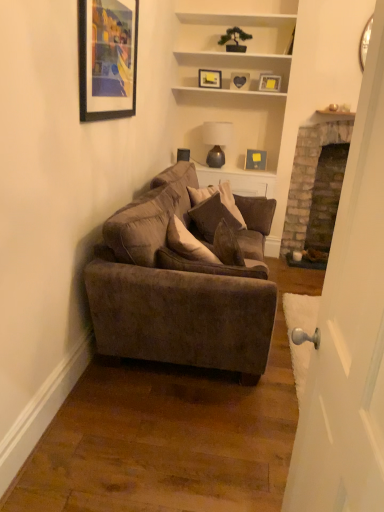
Identify the location of white wood shelves at upper center. This screenshot has width=384, height=512. coord(231,52).

The width and height of the screenshot is (384, 512). Describe the element at coordinates (308, 176) in the screenshot. I see `brick fireplace at right` at that location.

The image size is (384, 512). In order to click on white glossy door at right in this screenshot , I will do `click(349, 330)`.

Find the location of `matte gold picture frame at upper center, which ranks as the fourth picture frame in back-to-front order`. matte gold picture frame at upper center, which ranks as the fourth picture frame in back-to-front order is located at coordinates (269, 82).

At what (x,y) coordinates should I click in order to perform the action: click on matte wooden picture frame at upper center, placed as the 4th picture frame when sorted from right to left. Please return your answer as a coordinate pair (x, y). This screenshot has height=512, width=384. Looking at the image, I should click on (210, 78).

Locate an element on the screen. This screenshot has width=384, height=512. velvet brown couch at center is located at coordinates (182, 284).

Which object is further away from the camera taking this photo, matte gold picture frame at upper center, positioned as the 2th picture frame in front-to-back order, or matte black picture frame at upper left, which is counted as the 1th picture frame, starting from the front?

matte gold picture frame at upper center, positioned as the 2th picture frame in front-to-back order, is further from the camera.

Which is correct: matte gold picture frame at upper center, positioned as the 2th picture frame in front-to-back order, is inside matte black picture frame at upper left, which ranks as the 5th picture frame in back-to-front order, or outside of it?

matte gold picture frame at upper center, positioned as the 2th picture frame in front-to-back order, is spatially situated outside matte black picture frame at upper left, which ranks as the 5th picture frame in back-to-front order.

Would you say matte gold picture frame at upper center, marked as the 1th picture frame in a right-to-left arrangement, is to the left or to the right of matte black picture frame at upper left, which is counted as the 1th picture frame, starting from the front, in the picture?

Based on their positions, matte gold picture frame at upper center, marked as the 1th picture frame in a right-to-left arrangement, is located to the right of matte black picture frame at upper left, which is counted as the 1th picture frame, starting from the front.

How different are the orientations of matte gold picture frame at upper center, which is the 5th picture frame in left-to-right order, and matte black picture frame at upper left, which is counted as the 1th picture frame, starting from the front, in degrees?

They differ by 109 degrees in their facing directions.

From the image's perspective, who appears lower, suede-like brown pillow at center or brick fireplace at right?

suede-like brown pillow at center appears lower in the image.

Is suede-like brown pillow at center not within brick fireplace at right?

That's correct, suede-like brown pillow at center is outside of brick fireplace at right.

From a real-world perspective, between suede-like brown pillow at center and brick fireplace at right, who is vertically lower?

In real-world perspective, suede-like brown pillow at center is lower.

Does suede-like brown pillow at center lie in front of brick fireplace at right?

That is True.

Is suede-like brown pillow at center located outside velvet brown couch at center?

No, most part of suede-like brown pillow at center lies within velvet brown couch at center.

Who is taller, suede-like brown pillow at center or velvet brown couch at center?

With more height is velvet brown couch at center.

Which object is thinner, suede-like brown pillow at center or velvet brown couch at center?

suede-like brown pillow at center is thinner.

From a real-world perspective, is suede-like brown pillow at center below velvet brown couch at center?

Actually, suede-like brown pillow at center is physically above velvet brown couch at center in the real world.

Which is more to the left, matte gray lampshade at upper center or white wood shelves at upper center?

matte gray lampshade at upper center is more to the left.

Does matte gray lampshade at upper center have a lesser width compared to white wood shelves at upper center?

Incorrect, the width of matte gray lampshade at upper center is not less than that of white wood shelves at upper center.

Would you consider matte gray lampshade at upper center to be distant from white wood shelves at upper center?

No, matte gray lampshade at upper center is in close proximity to white wood shelves at upper center.

Which is closer, (330, 371) or (110, 281)?

Point (330, 371) appears to be closer to the viewer than point (110, 281).

Is white glossy door at right facing away from velvet brown couch at center?

No, white glossy door at right is not facing the opposite direction of velvet brown couch at center.

From the image's perspective, which is below, white glossy door at right or velvet brown couch at center?

white glossy door at right appears lower in the image.

Is white glossy door at right at the right side of velvet brown couch at center?

Yes, white glossy door at right is to the right of velvet brown couch at center.

Considering the sizes of objects white glossy door at right and brick fireplace at right in the image provided, who is shorter, white glossy door at right or brick fireplace at right?

brick fireplace at right is shorter.

Who is bigger, white glossy door at right or brick fireplace at right?

Bigger between the two is brick fireplace at right.

Based on the photo, which of these two, white glossy door at right or brick fireplace at right, is wider?

With larger width is brick fireplace at right.

Find the location of a particular element. This screenshot has height=512, width=384. fireplace behind the white glossy door at right is located at coordinates (308, 176).

Considering the points (208, 165) and (259, 166), which point is in front, point (208, 165) or point (259, 166)?

The point (208, 165) is closer to the camera.

In the scene shown: Which is in front, matte gray lampshade at upper center or matte black picture frame at upper center, positioned as the 1th picture frame in back-to-front order?

Positioned in front is matte gray lampshade at upper center.

This screenshot has height=512, width=384. There is a matte gray lampshade at upper center. Find the location of `the 2nd picture frame below it (from the image's perspective)`. the 2nd picture frame below it (from the image's perspective) is located at coordinates [255, 160].

Consider the image. Considering the relative positions of matte gray lampshade at upper center and matte black picture frame at upper center, acting as the second picture frame starting from the right, in the image provided, is matte gray lampshade at upper center to the right of matte black picture frame at upper center, acting as the second picture frame starting from the right, from the viewer's perspective?

No.

Find the location of a particular element. Image resolution: width=384 pixels, height=512 pixels. picture frame that is the 1st object located behind the matte black picture frame at upper left, the 1th picture frame from the left is located at coordinates (269, 82).

Image resolution: width=384 pixels, height=512 pixels. What are the coordinates of `pillow directly beneath the brick fireplace at right (from a real-world perspective)` in the screenshot? It's located at coord(212,217).

From the image, which object appears to be nearer to matte black picture frame at upper center, which ranks as the 5th picture frame in front-to-back order, heart-shaped frame at upper center, which ranks as the 3th picture frame in left-to-right order, or matte wooden picture frame at upper center, arranged as the 2th picture frame when viewed from the left?

heart-shaped frame at upper center, which ranks as the 3th picture frame in left-to-right order, is positioned closer to the anchor matte black picture frame at upper center, which ranks as the 5th picture frame in front-to-back order.

Which object lies further to the anchor point brick fireplace at right, matte gold picture frame at upper center, which ranks as the fourth picture frame in back-to-front order, or matte black picture frame at upper center, positioned as the 4th picture frame in left-to-right order?

matte gold picture frame at upper center, which ranks as the fourth picture frame in back-to-front order, is further to brick fireplace at right.

From the image, which object appears to be nearer to matte gold picture frame at upper center, which ranks as the fourth picture frame in back-to-front order, matte wooden picture frame at upper center, positioned as the 4th picture frame in front-to-back order, or brick fireplace at right?

matte wooden picture frame at upper center, positioned as the 4th picture frame in front-to-back order, lies closer to matte gold picture frame at upper center, which ranks as the fourth picture frame in back-to-front order, than the other object.

Which object lies further to the anchor point white glossy door at right, suede-like brown pillow at center or matte wooden picture frame at upper center, placed as the 4th picture frame when sorted from right to left?

Based on the image, matte wooden picture frame at upper center, placed as the 4th picture frame when sorted from right to left, appears to be further to white glossy door at right.

From the image, which object appears to be nearer to matte gray lampshade at upper center, velvet brown couch at center or brick fireplace at right?

brick fireplace at right lies closer to matte gray lampshade at upper center than the other object.

Which object lies nearer to the anchor point matte wooden picture frame at upper center, positioned as the 4th picture frame in front-to-back order, white glossy door at right or matte black picture frame at upper center, which ranks as the 5th picture frame in front-to-back order?

matte black picture frame at upper center, which ranks as the 5th picture frame in front-to-back order, is positioned closer to the anchor matte wooden picture frame at upper center, positioned as the 4th picture frame in front-to-back order.

Estimate the real-world distances between objects in this image. Which object is closer to matte gray lampshade at upper center, matte gold picture frame at upper center, marked as the 1th picture frame in a right-to-left arrangement, or matte black picture frame at upper center, positioned as the 4th picture frame in left-to-right order?

matte black picture frame at upper center, positioned as the 4th picture frame in left-to-right order, lies closer to matte gray lampshade at upper center than the other object.

Estimate the real-world distances between objects in this image. Which object is closer to matte black picture frame at upper left, positioned as the 5th picture frame in right-to-left order, white wood shelves at upper center or matte wooden picture frame at upper center, arranged as the 2th picture frame when viewed from the left?

white wood shelves at upper center is closer to matte black picture frame at upper left, positioned as the 5th picture frame in right-to-left order.

At what (x,y) coordinates should I click in order to perform the action: click on pillow between white glossy door at right and matte gray lampshade at upper center in the front-back direction. Please return your answer as a coordinate pair (x, y). This screenshot has width=384, height=512. Looking at the image, I should click on (212, 217).

Locate an element on the screen. cabinet between white glossy door at right and matte black picture frame at upper center, which ranks as the 5th picture frame in front-to-back order, in the front-back direction is located at coordinates (231, 52).

At what (x,y) coordinates should I click in order to perform the action: click on lamp between matte gold picture frame at upper center, positioned as the 2th picture frame in front-to-back order, and suede-like brown pillow at center in the up-down direction. Please return your answer as a coordinate pair (x, y). Looking at the image, I should click on (216, 141).

This screenshot has height=512, width=384. I want to click on pillow between matte black picture frame at upper left, which is counted as the 1th picture frame, starting from the front, and white wood shelves at upper center from front to back, so click(x=212, y=217).